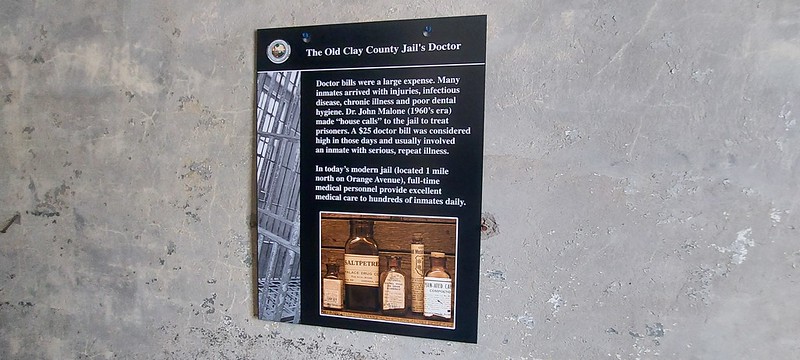
Locate an element on the screen. This screenshot has height=360, width=800. cement wall left of placard is located at coordinates (138, 120).